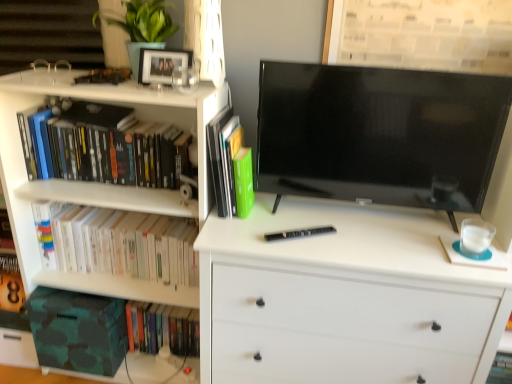
Identify the location of vacant area that lies between black matte pen at center and green matte book at center, which is the third book from bottom to top. This screenshot has height=384, width=512. (271, 223).